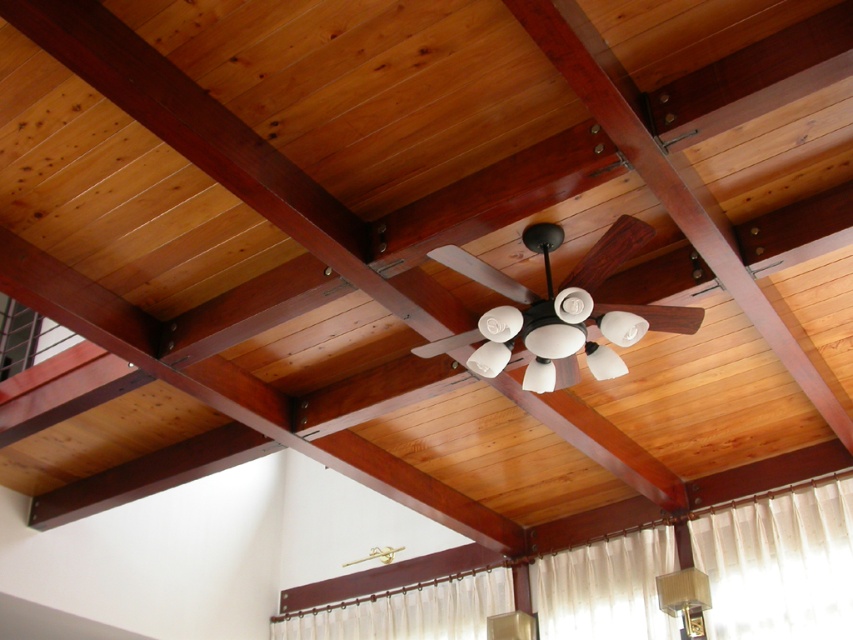
You are an interior designer assessing the ceiling layout. The white matte fan at center and the matte white lampshade at lower right are both white. Which object takes up more space in the ceiling area?

The white matte fan at center is bigger than the matte white lampshade at lower right, so it occupies more space in the ceiling area.

Consider the image. You are decorating a room and need to know which object has a greater width. You see a white sheer curtain at lower center and a matte white lampshade at lower right. Which one is wider?

The white sheer curtain at lower center is wider than the matte white lampshade at lower right according to the description.